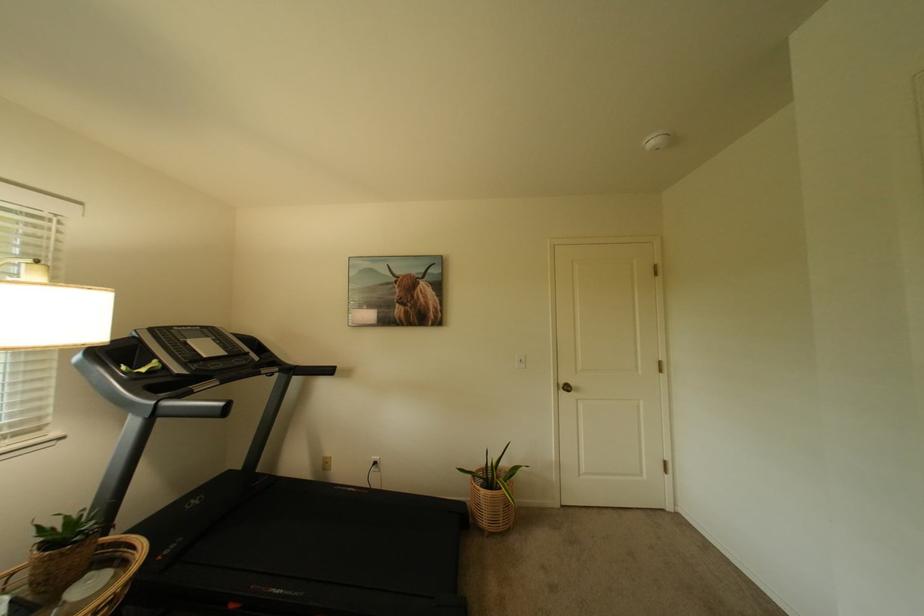
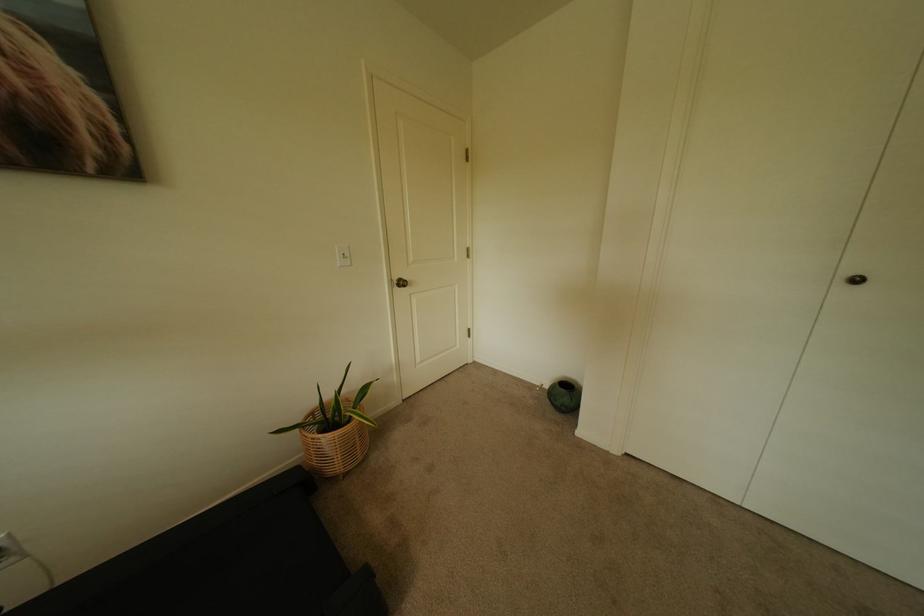
How did the camera likely rotate?

The camera rotated toward right-down.